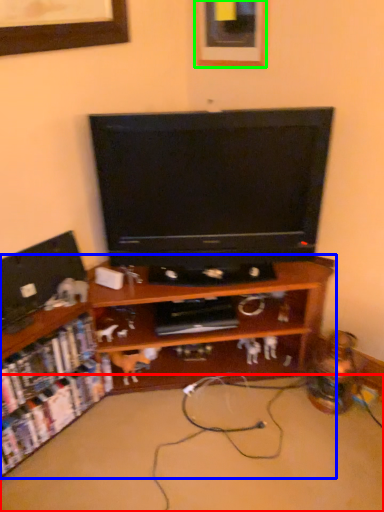
Question: Which object is positioned farthest from plain (highlighted by a red box)? Select from shelf (highlighted by a blue box) and picture frame (highlighted by a green box).

Choices:
 (A) shelf
 (B) picture frame

Answer: (B)